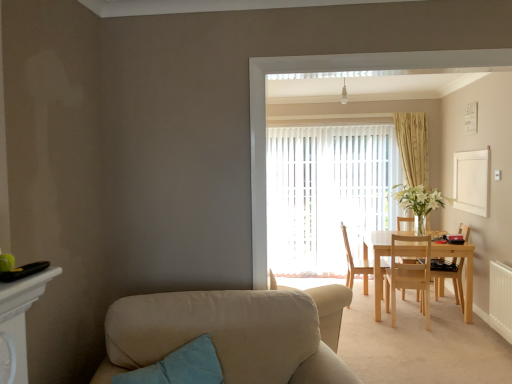
What are the coordinates of `spots to the right of light wood chair at center, which is the second chair from left to right` in the screenshot? It's located at (459, 327).